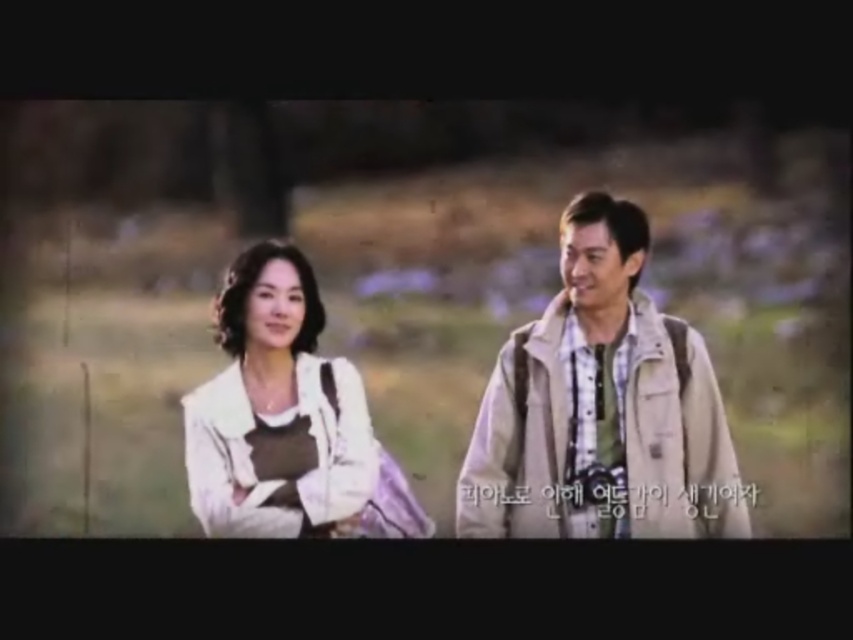
You are a photographer who wants to adjust the focus of your camera to capture the beige canvas jacket at center. Given that the point you need to focus on is at coordinates point (601,408), can you confirm if this point is within the blurred background or the focused foreground?

The point (601,408) corresponds to the beige canvas jacket at center, which is part of the focused foreground since the background is softly blurred.

You are a fashion stylist preparing for a photoshoot. You have two jackets available for styling today. The beige canvas jacket at center and the white fabric jacket at left. Based on their sizes, which jacket would you recommend to a client who prefers a more oversized look?

The beige canvas jacket at center has a greater height compared to the white fabric jacket at left, so it would be the better choice for a client seeking an oversized look.